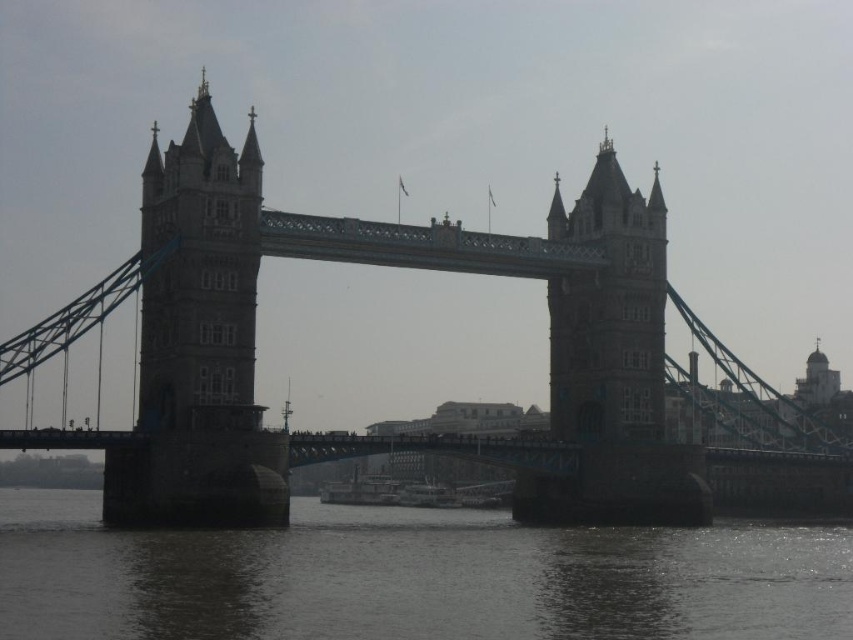
You are a tourist standing on the Thames River walkway near Tower Bridge. You notice the dark gray water at lower center and the gray stone tower at left. Which object in the scene takes up more visual space?

The dark gray water at lower center takes up more visual space than the gray stone tower at left because it is bigger in the scene.

You are standing at a point in London and want to take a photo of the Tower Bridge. The camera you are using has a focal length of 50mm. If the point you are standing at is labeled as point (364, 614), can you estimate how far you are from the Tower Bridge in feet?

The distance between point (364, 614) and the camera is 329.82 feet, so you are approximately 329.82 feet away from the Tower Bridge.